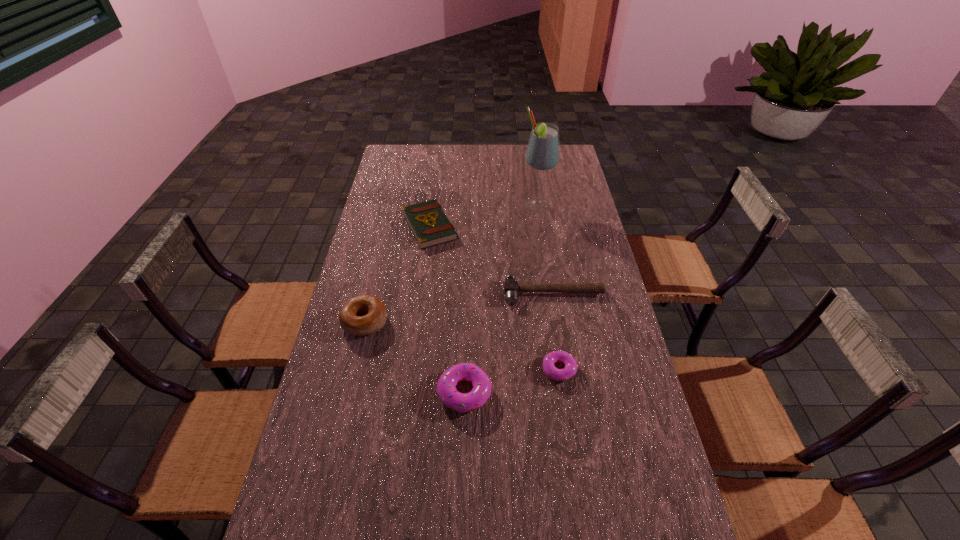
Where is `free space that satisfies the following two spatial constraints: 1. on the front side of the taller doughnut; 2. on the left side of the book`? The width and height of the screenshot is (960, 540). free space that satisfies the following two spatial constraints: 1. on the front side of the taller doughnut; 2. on the left side of the book is located at coordinates (408, 393).